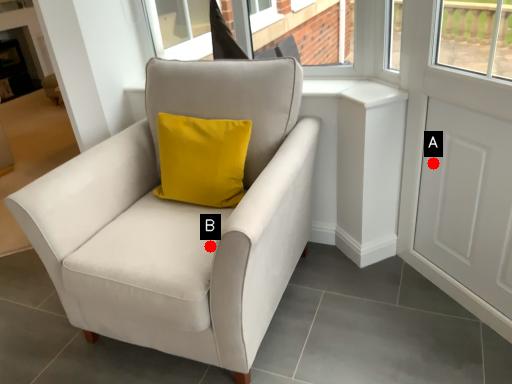
Question: Two points are circled on the image, labeled by A and B beside each circle. Which point appears farthest from the camera in this image?

Choices:
 (A) A is further
 (B) B is further

Answer: (A)